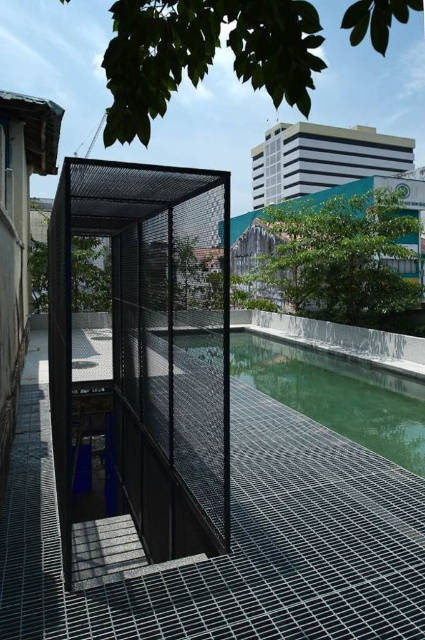
Question: Does black mesh cage at center appear on the left side of green glass water at center?

Choices:
 (A) yes
 (B) no

Answer: (A)

Question: Which object appears closest to the camera in this image?

Choices:
 (A) green glass water at center
 (B) black mesh cage at center

Answer: (B)

Question: Can you confirm if black mesh cage at center is positioned below green glass water at center?

Choices:
 (A) no
 (B) yes

Answer: (A)

Question: Which object is farther from the camera taking this photo?

Choices:
 (A) green glass water at center
 (B) black mesh cage at center

Answer: (A)

Question: Among these objects, which one is nearest to the camera?

Choices:
 (A) black mesh cage at center
 (B) green glass water at center

Answer: (A)

Question: Is black mesh cage at center thinner than green glass water at center?

Choices:
 (A) yes
 (B) no

Answer: (B)